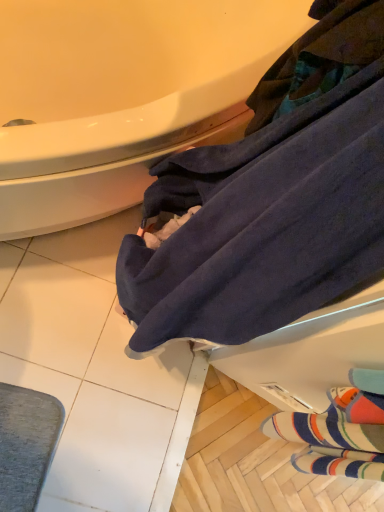
Question: Could you tell me if white glossy bathtub at upper left is turned towards striped wool socks at lower right?

Choices:
 (A) yes
 (B) no

Answer: (B)

Question: From a real-world perspective, is white glossy bathtub at upper left beneath striped wool socks at lower right?

Choices:
 (A) no
 (B) yes

Answer: (B)

Question: Considering the relative sizes of white glossy bathtub at upper left and striped wool socks at lower right in the image provided, is white glossy bathtub at upper left bigger than striped wool socks at lower right?

Choices:
 (A) no
 (B) yes

Answer: (B)

Question: From the image's perspective, is white glossy bathtub at upper left located above striped wool socks at lower right?

Choices:
 (A) no
 (B) yes

Answer: (B)

Question: Is white glossy bathtub at upper left outside striped wool socks at lower right?

Choices:
 (A) no
 (B) yes

Answer: (B)

Question: Can you confirm if white glossy bathtub at upper left is positioned to the right of striped wool socks at lower right?

Choices:
 (A) yes
 (B) no

Answer: (B)

Question: From a real-world perspective, is striped wool socks at lower right located beneath white glossy bathtub at upper left?

Choices:
 (A) yes
 (B) no

Answer: (B)

Question: From the image's perspective, is striped wool socks at lower right below white glossy bathtub at upper left?

Choices:
 (A) no
 (B) yes

Answer: (B)

Question: Is striped wool socks at lower right shorter than white glossy bathtub at upper left?

Choices:
 (A) yes
 (B) no

Answer: (A)

Question: Considering the relative sizes of striped wool socks at lower right and white glossy bathtub at upper left in the image provided, is striped wool socks at lower right smaller than white glossy bathtub at upper left?

Choices:
 (A) no
 (B) yes

Answer: (B)

Question: Is striped wool socks at lower right turned away from white glossy bathtub at upper left?

Choices:
 (A) yes
 (B) no

Answer: (B)

Question: Is striped wool socks at lower right positioned before white glossy bathtub at upper left?

Choices:
 (A) yes
 (B) no

Answer: (B)

Question: Is white glossy bathtub at upper left a part of dark blue towel at lower right?

Choices:
 (A) no
 (B) yes

Answer: (A)